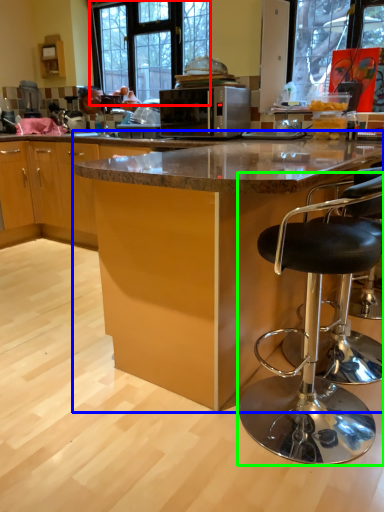
Question: Which is nearer to the window (highlighted by a red box)? table (highlighted by a blue box) or chair (highlighted by a green box).

Choices:
 (A) table
 (B) chair

Answer: (A)